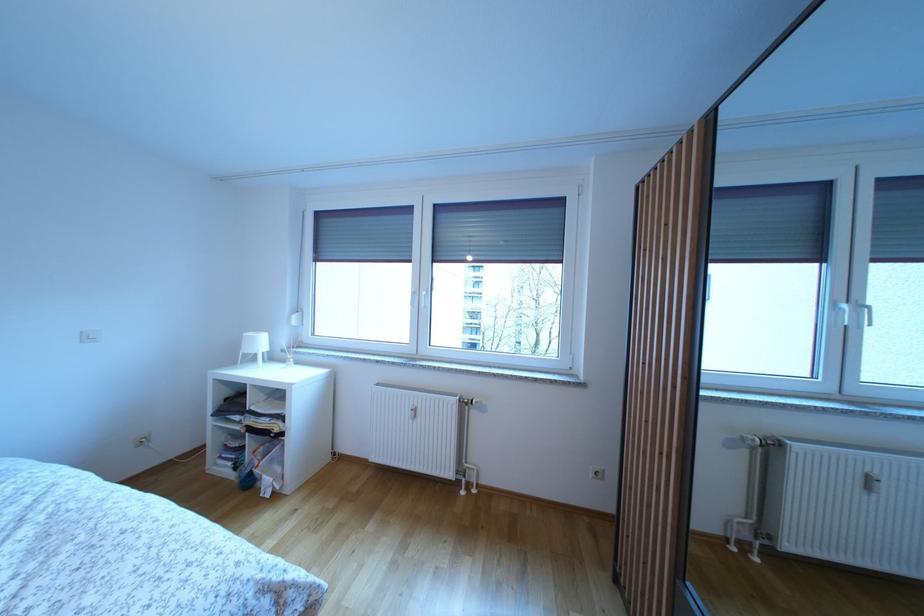
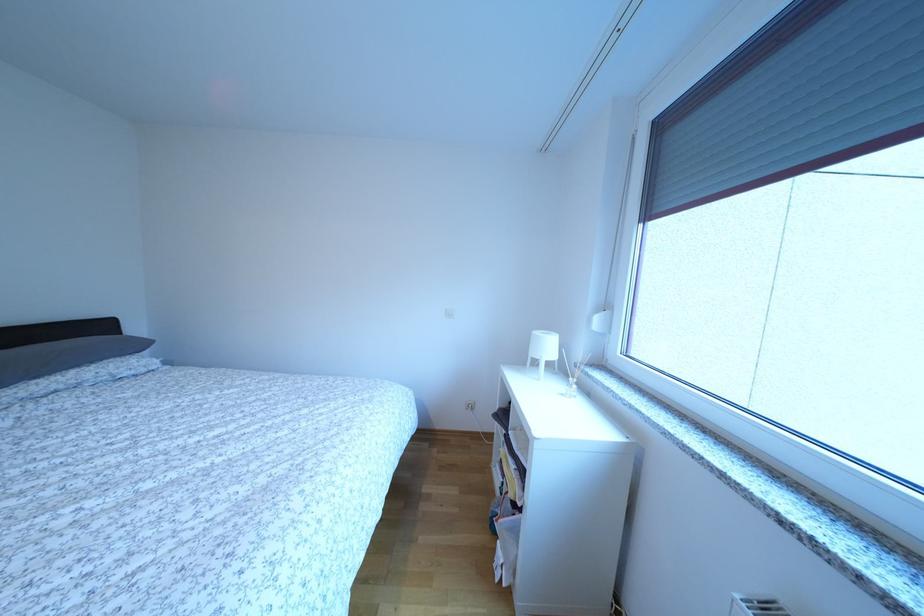
Find the pixel in the second image that matches pixel 268 349 in the first image.

(554, 353)